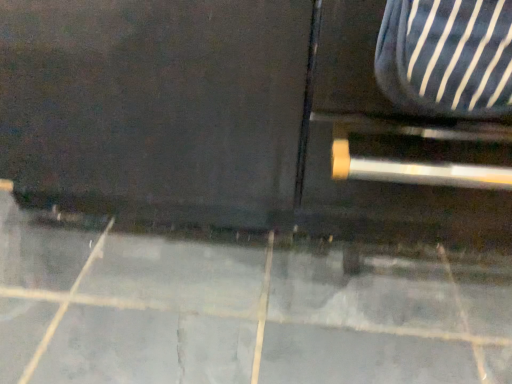
Question: Does point (173, 319) appear closer or farther from the camera than point (493, 23)?

Choices:
 (A) farther
 (B) closer

Answer: (A)

Question: Would you say gray tile floor at lower center is to the left or to the right of striped fabric armchair at right in the picture?

Choices:
 (A) left
 (B) right

Answer: (A)

Question: Considering their positions, is gray tile floor at lower center located in front of or behind striped fabric armchair at right?

Choices:
 (A) front
 (B) behind

Answer: (B)

Question: In terms of height, does striped fabric armchair at right look taller or shorter compared to gray tile floor at lower center?

Choices:
 (A) tall
 (B) short

Answer: (A)

Question: Would you say striped fabric armchair at right is inside or outside gray tile floor at lower center?

Choices:
 (A) inside
 (B) outside

Answer: (B)

Question: Considering their positions, is striped fabric armchair at right located in front of or behind gray tile floor at lower center?

Choices:
 (A) behind
 (B) front

Answer: (B)

Question: In terms of width, does striped fabric armchair at right look wider or thinner when compared to gray tile floor at lower center?

Choices:
 (A) wide
 (B) thin

Answer: (B)